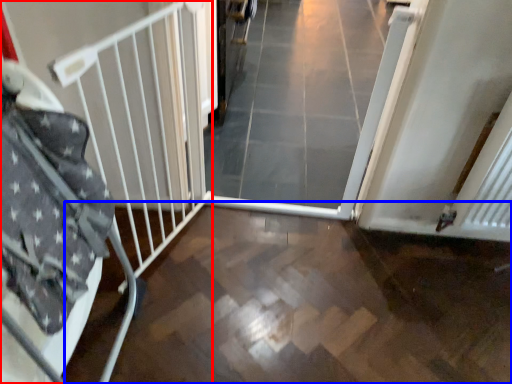
Question: Which point is further to the camera, bed frame (highlighted by a red box) or path (highlighted by a blue box)?

Choices:
 (A) bed frame
 (B) path

Answer: (B)